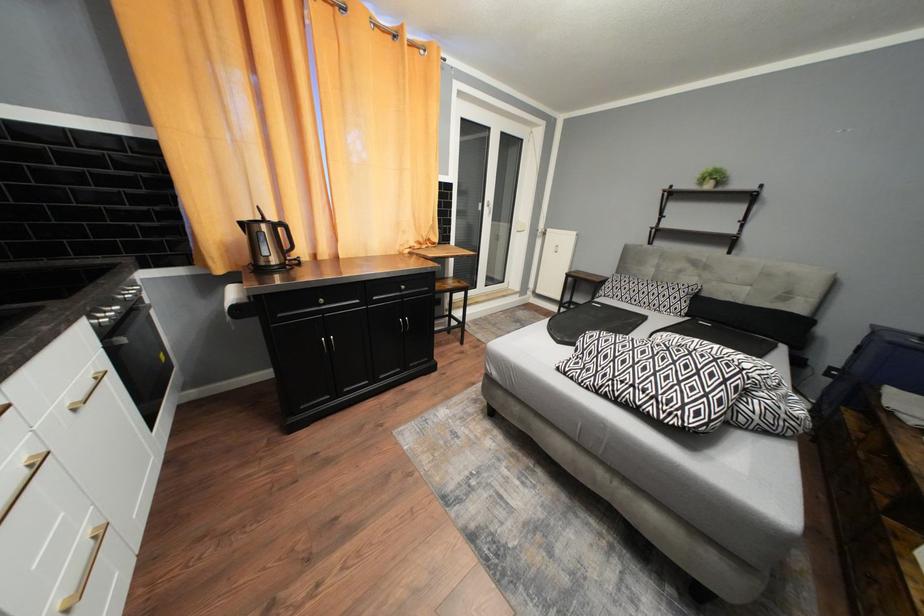
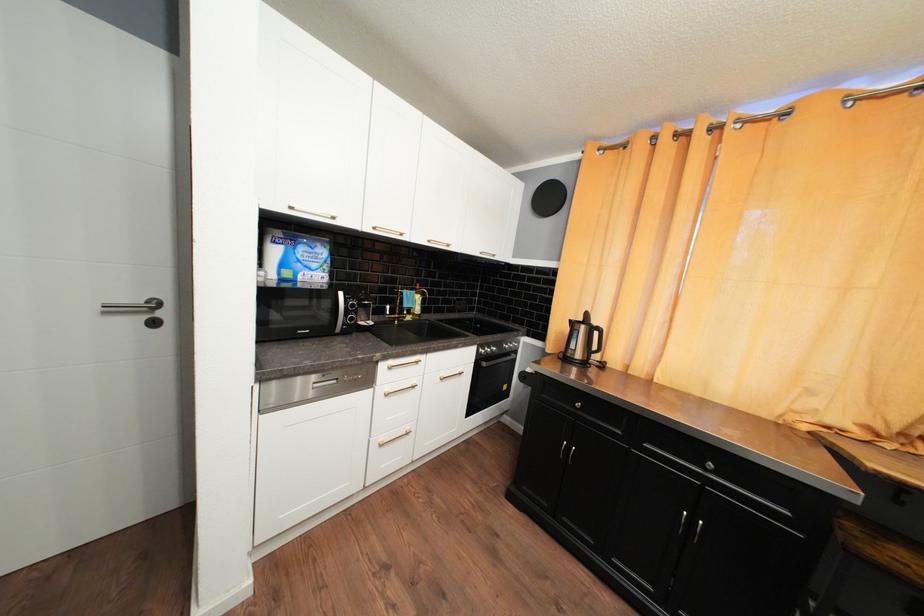
Question: Based on the continuous images, in which direction is the camera rotating? Reply with the corresponding letter.

Choices:
 (A) Left
 (B) Right
 (C) Up
 (D) Down

Answer: (A)